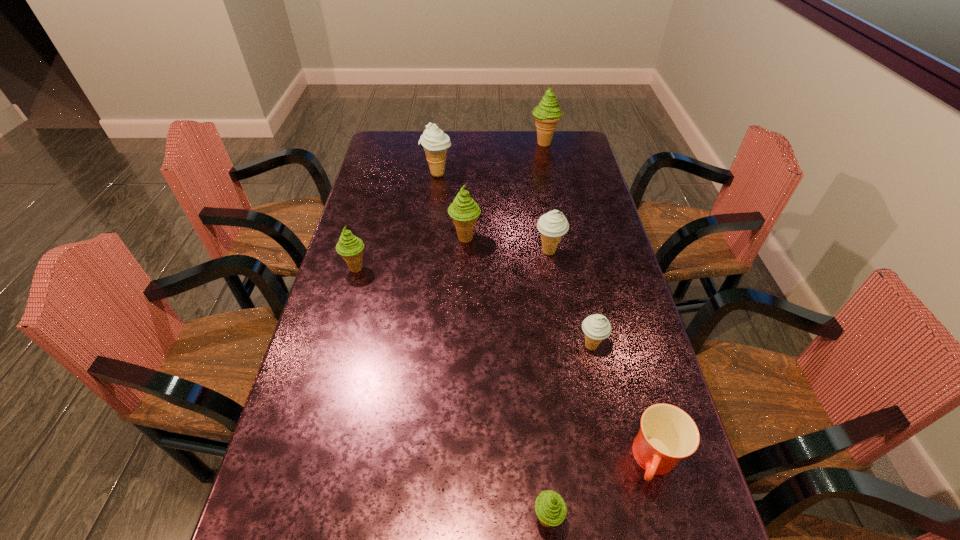
Select which object is the fourth closest to the leftmost green icecream. Please provide its 2D coordinates. Your answer should be formatted as a tuple, i.e. [(x, y)], where the tuple contains the x and y coordinates of a point satisfying the conditions above.

[(596, 328)]

What are the coordinates of `object that is the sixth nearest to the nearest icecream` in the screenshot? It's located at (435, 142).

Identify which icecream is the third closest to the farthest green icecream. Please provide its 2D coordinates. Your answer should be formatted as a tuple, i.e. [(x, y)], where the tuple contains the x and y coordinates of a point satisfying the conditions above.

[(552, 225)]

Select which icecream appears as the third closest to the second green icecream from left to right. Please provide its 2D coordinates. Your answer should be formatted as a tuple, i.e. [(x, y)], where the tuple contains the x and y coordinates of a point satisfying the conditions above.

[(435, 142)]

Locate an element on the screen. The height and width of the screenshot is (540, 960). green icecream that stands as the fourth closest to the second farthest icecream is located at coordinates (550, 508).

Choose which green icecream is the third nearest neighbor to the second biggest green icecream. Please provide its 2D coordinates. Your answer should be formatted as a tuple, i.e. [(x, y)], where the tuple contains the x and y coordinates of a point satisfying the conditions above.

[(550, 508)]

The width and height of the screenshot is (960, 540). In order to click on beige icecream identified as the third closest to the tallest icecream in this screenshot , I will do `click(596, 328)`.

This screenshot has width=960, height=540. Identify the location of beige icecream that is the closest one to the fourth icecream from right to left. (596, 328).

Where is `free space that satisfies the following two spatial constraints: 1. on the front side of the biggest green icecream; 2. on the right side of the seventh farthest object`? The height and width of the screenshot is (540, 960). free space that satisfies the following two spatial constraints: 1. on the front side of the biggest green icecream; 2. on the right side of the seventh farthest object is located at coordinates (607, 461).

You are a GUI agent. You are given a task and a screenshot of the screen. Output one action in this format:
    pyautogui.click(x=<x>, y=<y>)
    Task: Click on the vacant position in the image that satisfies the following two spatial constraints: 1. on the back side of the second farthest beige icecream; 2. on the left side of the biggest green icecream
    The image size is (960, 540).
    Given the screenshot: What is the action you would take?
    pyautogui.click(x=532, y=143)